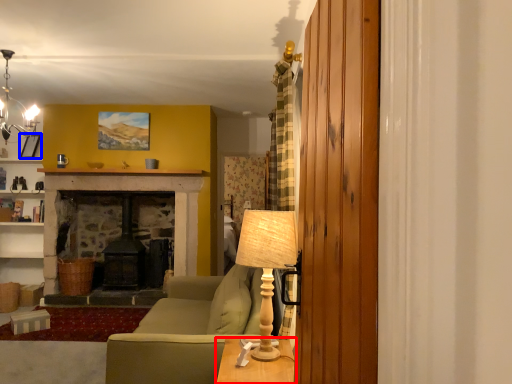
Question: Which point is further to the camera, table (highlighted by a red box) or picture frame (highlighted by a blue box)?

Choices:
 (A) table
 (B) picture frame

Answer: (B)